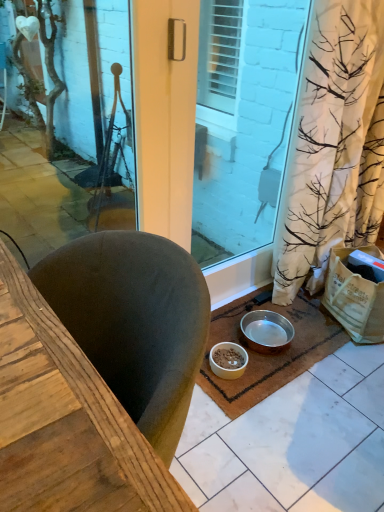
What are the coordinates of `free space in front of metallic silver bowl at lower center, which appears as the 2th bowl when viewed from the left` in the screenshot? It's located at [x=269, y=374].